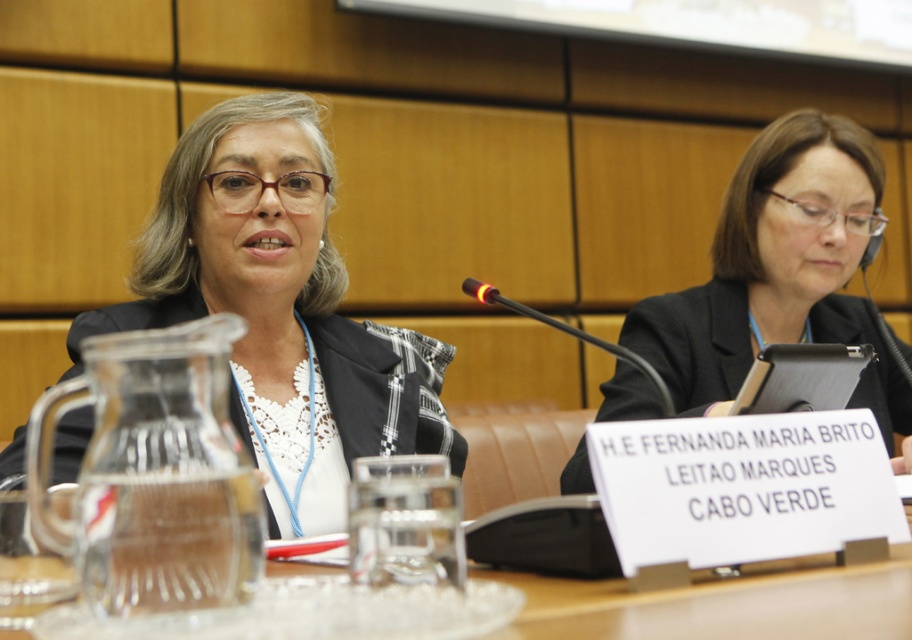
You are a photographer positioned at the camera location. You need to capture a closeup shot of the clear glass pitcher at left. Can you reach it without moving the camera? Please explain your reasoning.

The clear glass pitcher at left is 67.09 centimeters away from camera. Since the distance is within a typical photographer reach, you can likely extend your arm to capture the closeup without moving the camera.

You are organizing a meeting and need to place a new nameplate between the matte black jacket at center and the clear glass water at center. Which object should you place the nameplate closer to if you want to ensure it doesn not block the view of the smaller object?

The clear glass water at center is the smaller object, so you should place the nameplate closer to the matte black jacket at center to avoid blocking its view.